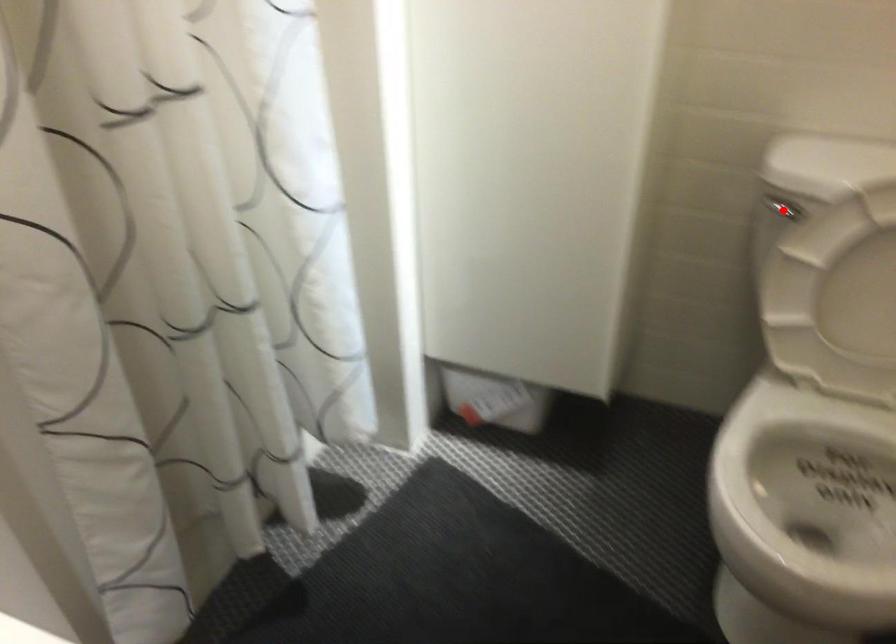
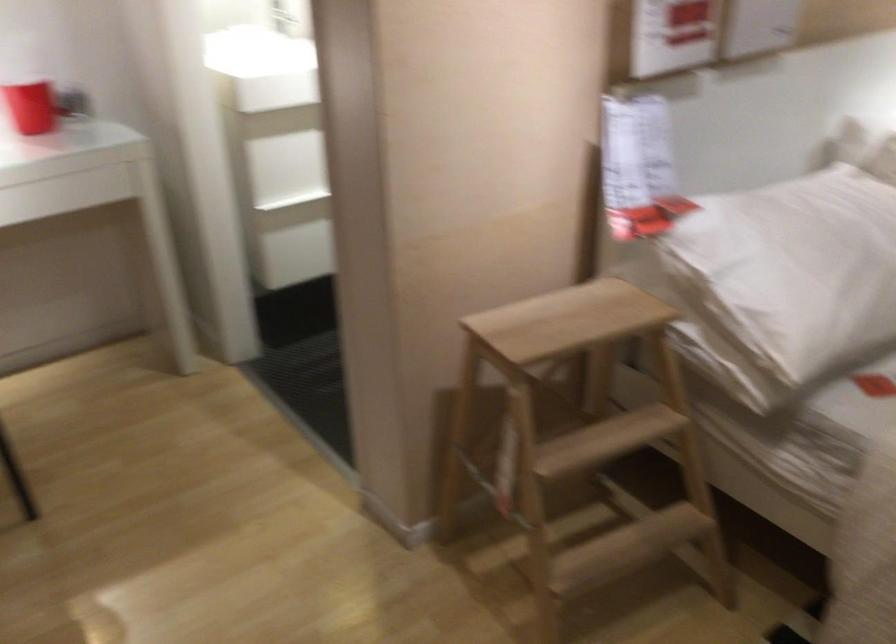
Question: I am providing you with two images of the same scene from different viewpoints. A red point is marked on the first image. Can you still see the location of the red point in image 2?

Choices:
 (A) Yes
 (B) No

Answer: (B)